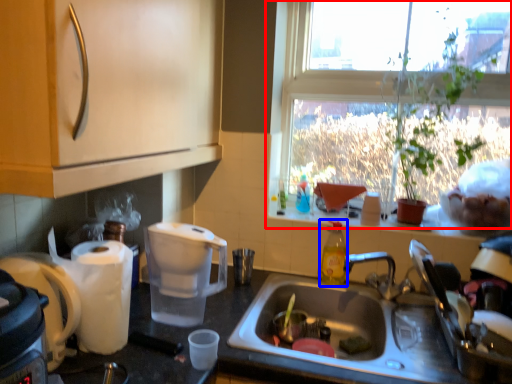
Question: Which object is further to the camera taking this photo, window (highlighted by a red box) or bottle (highlighted by a blue box)?

Choices:
 (A) window
 (B) bottle

Answer: (B)